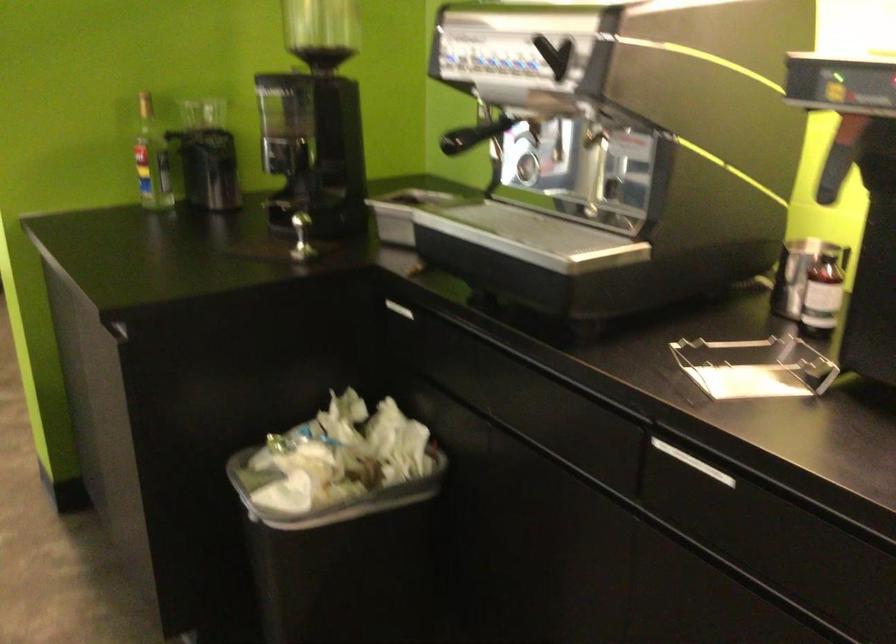
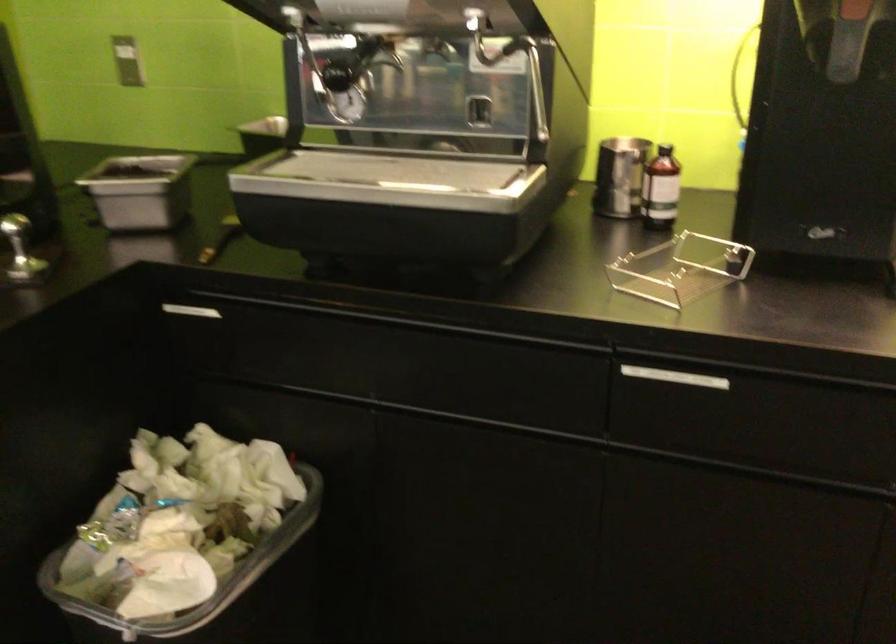
The point at (823, 258) is marked in the first image. Where is the corresponding point in the second image?

(666, 152)